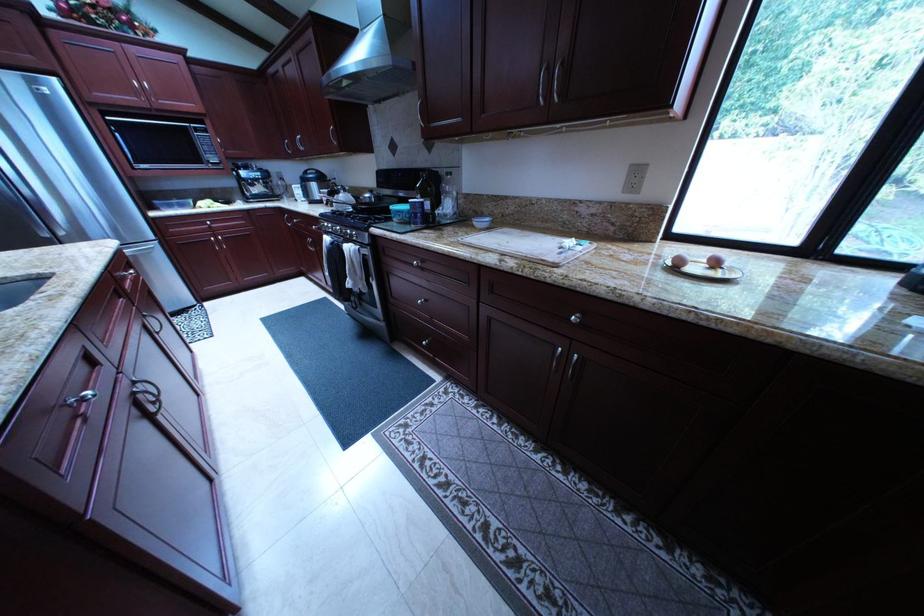
Where would you push the stove control knob? Please return your answer as a coordinate pair (x, y).

(365, 220)